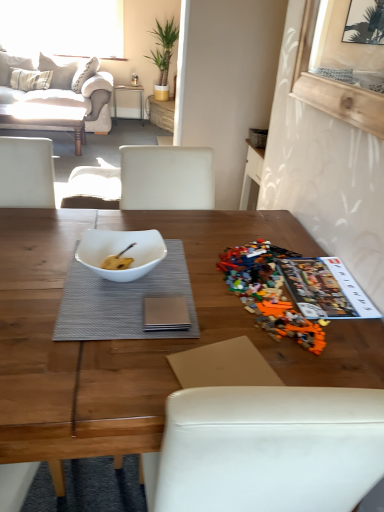
Image resolution: width=384 pixels, height=512 pixels. Find the location of `unoccupied space behind white glossy bowl at center`. unoccupied space behind white glossy bowl at center is located at coordinates (144, 228).